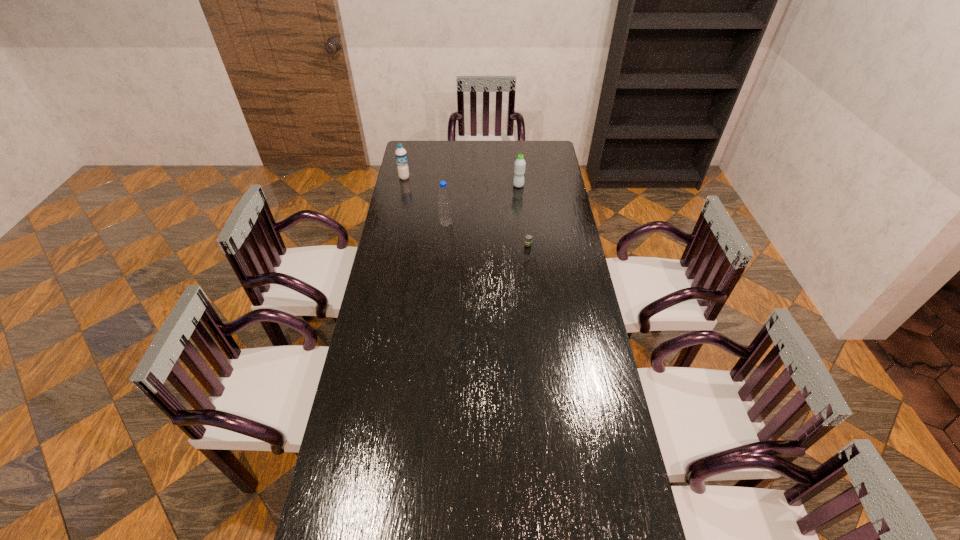
Identify which object is located as the second nearest to the second nearest object. Please provide its 2D coordinates. Your answer should be formatted as a tuple, i.e. [(x, y)], where the tuple contains the x and y coordinates of a point satisfying the conditions above.

[(401, 156)]

Image resolution: width=960 pixels, height=540 pixels. Identify the location of object that is the second closest to the leftmost water bottle. (519, 167).

Choose which water bottle is the nearest neighbor to the nearest object. Please provide its 2D coordinates. Your answer should be formatted as a tuple, i.e. [(x, y)], where the tuple contains the x and y coordinates of a point satisfying the conditions above.

[(444, 197)]

The width and height of the screenshot is (960, 540). In order to click on water bottle that stands as the second closest to the second nearest water bottle in this screenshot , I will do `click(401, 156)`.

What are the coordinates of `vacant area in the image that satisfies the following two spatial constraints: 1. on the label of the beer can; 2. on the right side of the leftmost object` in the screenshot? It's located at (390, 245).

Identify the location of free point that satisfies the following two spatial constraints: 1. on the front side of the second water bottle from left to right; 2. on the right side of the shortest object. [x=444, y=245].

At what (x,y) coordinates should I click in order to perform the action: click on vacant region that satisfies the following two spatial constraints: 1. on the label of the tallest object; 2. on the right side of the leftmost water bottle. Please return your answer as a coordinate pair (x, y). This screenshot has height=540, width=960. Looking at the image, I should click on (395, 224).

The image size is (960, 540). In order to click on free space that satisfies the following two spatial constraints: 1. on the label of the tallest water bottle; 2. on the right side of the farthest object in this screenshot , I will do `click(395, 224)`.